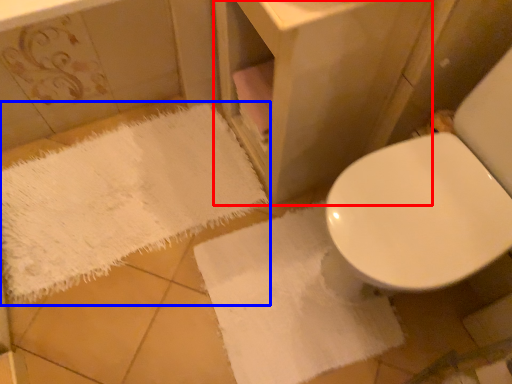
Question: Which object is further to the camera taking this photo, vanity (highlighted by a red box) or bath towel (highlighted by a blue box)?

Choices:
 (A) vanity
 (B) bath towel

Answer: (B)